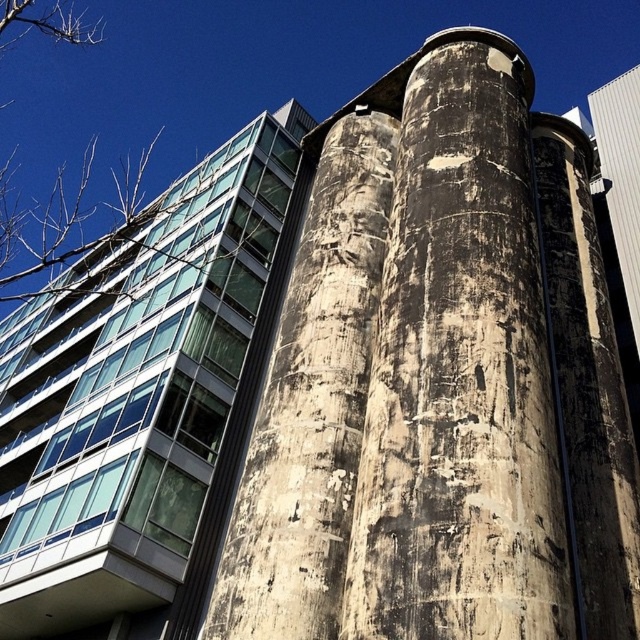
Question: Which of the following is the closest to the observer?

Choices:
 (A) (339, 419)
 (B) (192, 196)
 (C) (552, 397)

Answer: (C)

Question: Is concrete textured tower at center wider than weathered concrete pillar at center?

Choices:
 (A) yes
 (B) no

Answer: (A)

Question: Which object is closer to the camera taking this photo?

Choices:
 (A) concrete textured tower at center
 (B) weathered concrete pillar at center
 (C) weathered concrete silo at center

Answer: (C)

Question: Which point appears farthest from the camera in this image?

Choices:
 (A) (464, 284)
 (B) (269, 580)

Answer: (A)

Question: Considering the relative positions of weathered concrete silo at center and weathered concrete pillar at center in the image provided, where is weathered concrete silo at center located with respect to weathered concrete pillar at center?

Choices:
 (A) right
 (B) left

Answer: (A)

Question: Can you confirm if concrete textured tower at center is wider than weathered concrete silo at center?

Choices:
 (A) no
 (B) yes

Answer: (B)